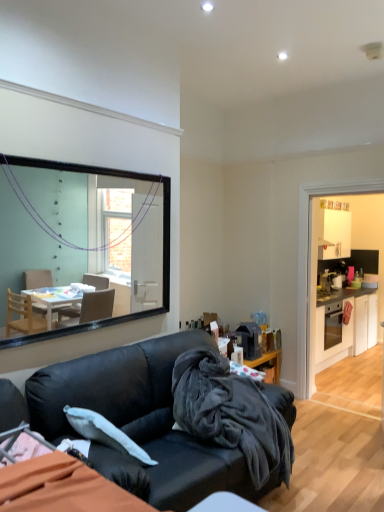
Question: From a real-world perspective, does white glossy dresser at right sit lower than velvety dark gray blanket at center?

Choices:
 (A) yes
 (B) no

Answer: (B)

Question: Is the depth of white glossy dresser at right greater than that of velvety dark gray blanket at center?

Choices:
 (A) yes
 (B) no

Answer: (A)

Question: Is white glossy dresser at right next to velvety dark gray blanket at center and touching it?

Choices:
 (A) yes
 (B) no

Answer: (B)

Question: Does white glossy dresser at right have a lesser height compared to velvety dark gray blanket at center?

Choices:
 (A) yes
 (B) no

Answer: (B)

Question: Is white glossy dresser at right positioned with its back to velvety dark gray blanket at center?

Choices:
 (A) yes
 (B) no

Answer: (B)

Question: Does point (253, 435) appear closer or farther from the camera than point (352, 218)?

Choices:
 (A) farther
 (B) closer

Answer: (B)

Question: Would you say velvety dark gray blanket at center is inside or outside white glossy dresser at right?

Choices:
 (A) inside
 (B) outside

Answer: (B)

Question: From a real-world perspective, is velvety dark gray blanket at center above or below white glossy dresser at right?

Choices:
 (A) below
 (B) above

Answer: (A)

Question: In terms of size, does velvety dark gray blanket at center appear bigger or smaller than white glossy dresser at right?

Choices:
 (A) big
 (B) small

Answer: (A)

Question: Relative to black leather couch at center, is velvety dark gray blanket at center in front or behind?

Choices:
 (A) front
 (B) behind

Answer: (B)

Question: Does point (221, 358) appear closer or farther from the camera than point (112, 391)?

Choices:
 (A) closer
 (B) farther

Answer: (B)

Question: From the image's perspective, relative to black leather couch at center, is velvety dark gray blanket at center above or below?

Choices:
 (A) below
 (B) above

Answer: (B)

Question: Is velvety dark gray blanket at center taller or shorter than black leather couch at center?

Choices:
 (A) tall
 (B) short

Answer: (B)

Question: Considering their positions, is white glossy cabinets at right located in front of or behind velvety dark gray blanket at center?

Choices:
 (A) behind
 (B) front

Answer: (A)

Question: Based on their sizes in the image, would you say white glossy cabinets at right is bigger or smaller than velvety dark gray blanket at center?

Choices:
 (A) small
 (B) big

Answer: (B)